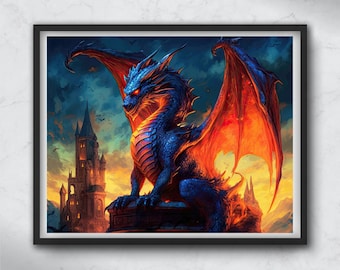
I want to click on painting, so click(x=83, y=66).